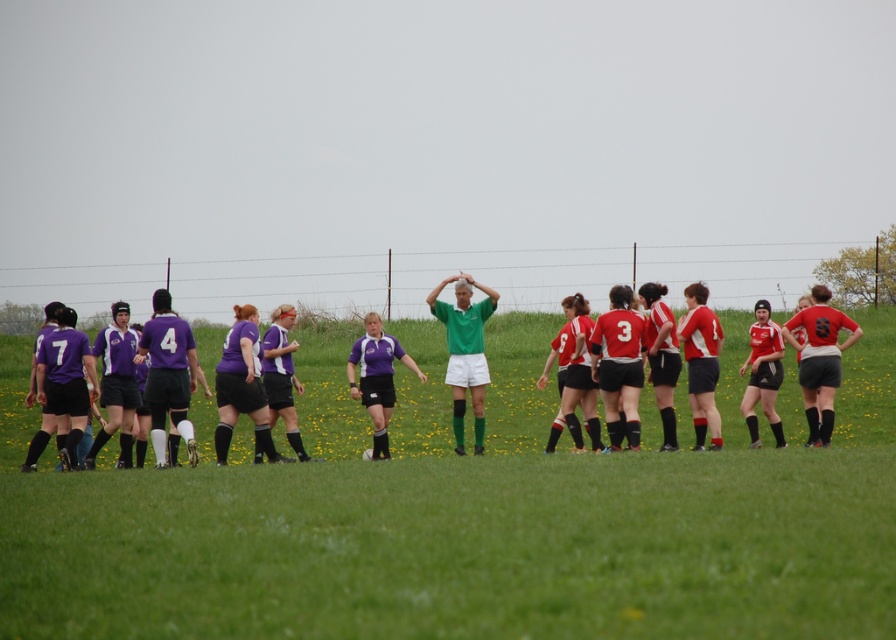
Is matte purple jersey at center smaller than green matte jersey at center?

Correct, matte purple jersey at center occupies less space than green matte jersey at center.

The height and width of the screenshot is (640, 896). I want to click on matte purple jersey at center, so click(242, 385).

Is purple jersey at left positioned at the back of matte purple jersey at center?

No, purple jersey at left is in front of matte purple jersey at center.

Who is shorter, purple jersey at left or matte purple jersey at center?

Standing shorter between the two is matte purple jersey at center.

Does point (535, 394) come farther from viewer compared to point (237, 369)?

Yes, point (535, 394) is farther from viewer.

What are the coordinates of `purple jersey at left` in the screenshot? It's located at (626, 401).

Can you confirm if green grass field at center is thinner than purple jersey at left?

No, green grass field at center is not thinner than purple jersey at left.

Which is below, green grass field at center or purple jersey at left?

green grass field at center is lower down.

Is point (488, 401) in front of point (110, 461)?

No, it is not.

At what (x,y) coordinates should I click in order to perform the action: click on green grass field at center. Please return your answer as a coordinate pair (x, y). This screenshot has height=640, width=896. Looking at the image, I should click on (468, 516).